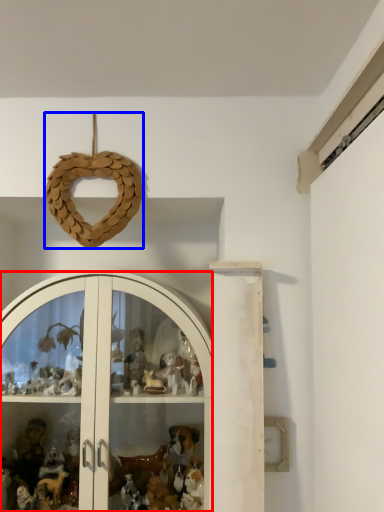
Question: Which of the following is the farthest to the observer, glass door (highlighted by a red box) or toy (highlighted by a blue box)?

Choices:
 (A) glass door
 (B) toy

Answer: (B)